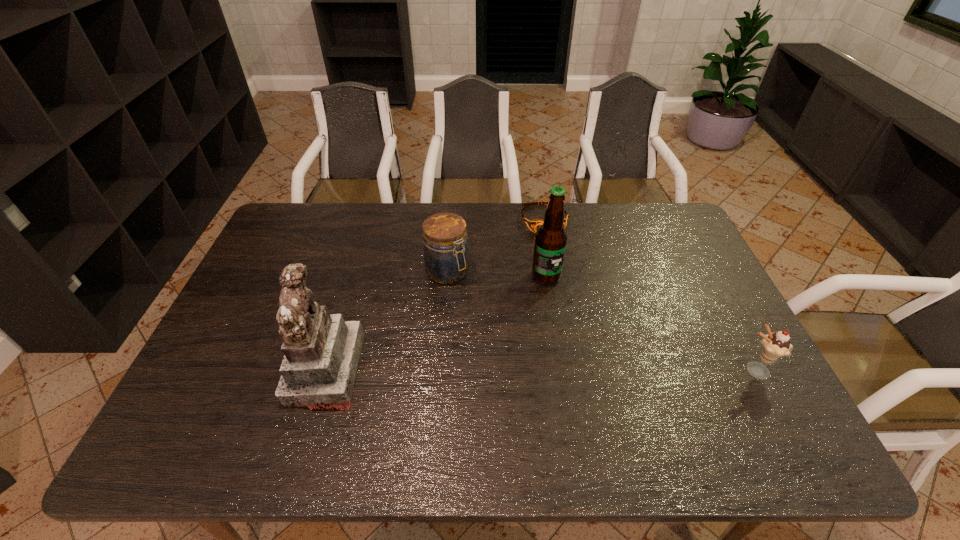
This screenshot has width=960, height=540. In order to click on figurine in this screenshot , I will do `click(321, 351)`.

Identify the location of icecream. (774, 346).

The height and width of the screenshot is (540, 960). I want to click on the shortest object, so click(534, 223).

In order to click on the farthest object in this screenshot , I will do `click(534, 223)`.

You are a GUI agent. You are given a task and a screenshot of the screen. Output one action in this format:
    pyautogui.click(x=<x>, y=<y>)
    Task: Click on the beer bottle
    
    Given the screenshot: What is the action you would take?
    pyautogui.click(x=551, y=238)

In order to click on the fourth object from right to left in this screenshot , I will do `click(446, 257)`.

At what (x,y) coordinates should I click in order to perform the action: click on free spot located on the front-facing side of the leftmost object. Please return your answer as a coordinate pair (x, y). The width and height of the screenshot is (960, 540). Looking at the image, I should click on (244, 369).

Locate an element on the screen. This screenshot has height=540, width=960. blank space located on the front-facing side of the leftmost object is located at coordinates (264, 369).

Find the location of a particular element. The height and width of the screenshot is (540, 960). vacant region located 0.230m on the front-facing side of the leftmost object is located at coordinates (201, 369).

The height and width of the screenshot is (540, 960). I want to click on free spot located on the left of the icecream, so click(629, 371).